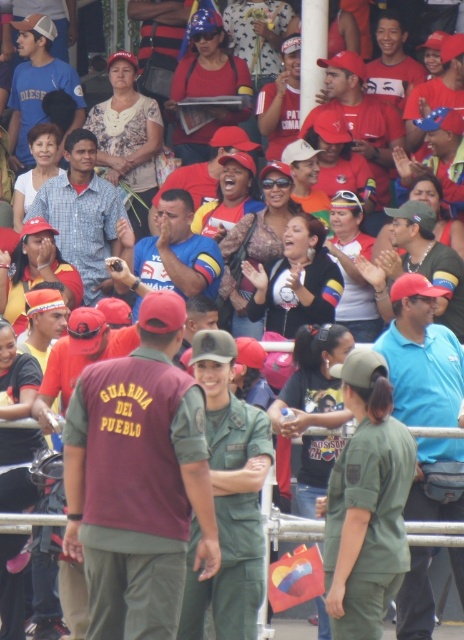
Does blue cotton shirt at center appear on the right side of matte red cap at center?

Incorrect, blue cotton shirt at center is not on the right side of matte red cap at center.

Does blue cotton shirt at center have a lesser height compared to matte red cap at center?

Indeed, blue cotton shirt at center has a lesser height compared to matte red cap at center.

Where is `blue cotton shirt at center`? blue cotton shirt at center is located at coordinates (421, 356).

You are a GUI agent. You are given a task and a screenshot of the screen. Output one action in this format:
    pyautogui.click(x=<x>, y=<y>)
    Task: Click on the blue cotton shirt at center
    The image size is (464, 640).
    Given the screenshot: What is the action you would take?
    pyautogui.click(x=421, y=356)

Is blue fabric shirt at center positioned before matte black cap at center?

That is True.

Can you confirm if blue fabric shirt at center is taller than matte black cap at center?

No.

Who is more forward, (212, 284) or (37, 52)?

Point (212, 284)

At what (x,y) coordinates should I click in order to perform the action: click on blue fabric shirt at center. Please return your answer as a coordinate pair (x, y). This screenshot has height=640, width=464. Looking at the image, I should click on (174, 250).

Which is behind, point (162, 525) or point (39, 92)?

Point (39, 92)

Does maroon uniform at center appear over matte black cap at center?

No, maroon uniform at center is not above matte black cap at center.

Identify the location of maroon uniform at center. (139, 481).